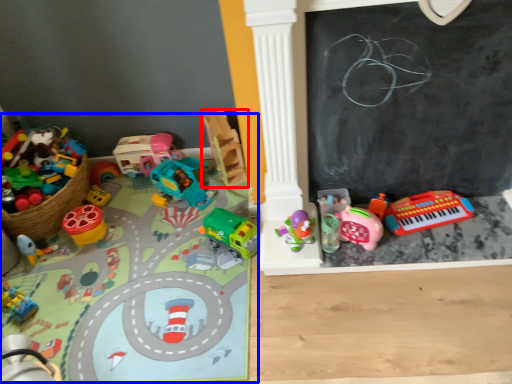
Question: Which object is further to the camera taking this photo, toy (highlighted by a red box) or toy (highlighted by a blue box)?

Choices:
 (A) toy
 (B) toy

Answer: (A)